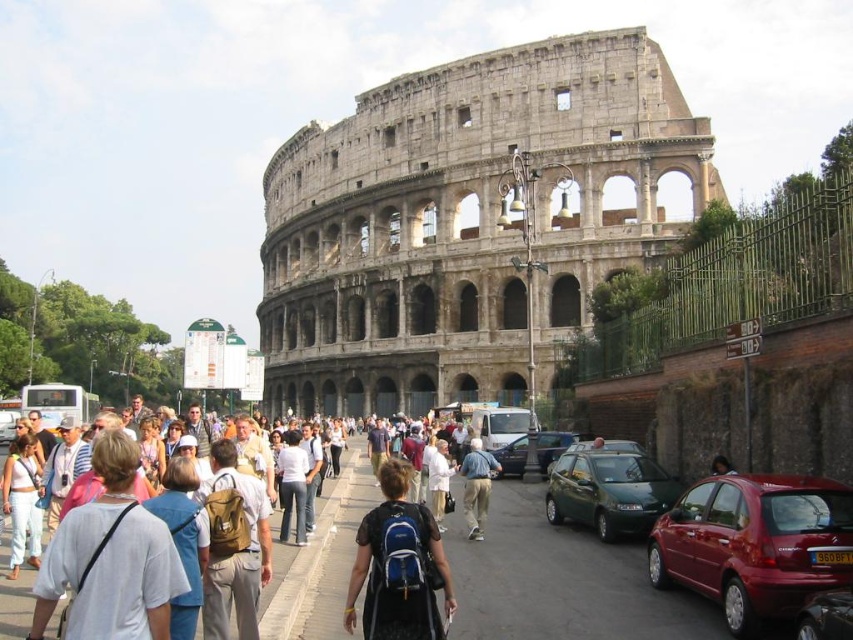
Question: Is white cotton shirt at center thinner than metallic red car at center?

Choices:
 (A) yes
 (B) no

Answer: (B)

Question: Which point appears closest to the camera in this image?

Choices:
 (A) (850, 596)
 (B) (302, 525)
 (C) (492, 141)

Answer: (A)

Question: Does white fabric backpack at center appear on the left side of white cotton shirt at center?

Choices:
 (A) yes
 (B) no

Answer: (A)

Question: Which of the following is the farthest from the observer?

Choices:
 (A) metallic gray sedan at center
 (B) white cotton shirt at center
 (C) stone amphitheater at center
 (D) white fabric backpack at center

Answer: (C)

Question: Among these points, which one is nearest to the camera?

Choices:
 (A) [x=1, y=490]
 (B) [x=720, y=538]
 (C) [x=523, y=435]
 (D) [x=817, y=625]

Answer: (D)

Question: Observing the image, what is the correct spatial positioning of white cotton shirt at center in reference to metallic red car at center?

Choices:
 (A) left
 (B) right

Answer: (A)